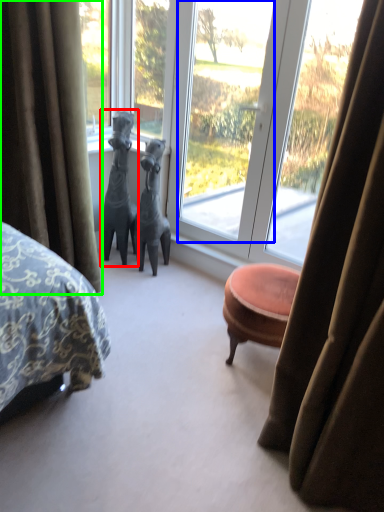
Question: Considering the real-world distances, which object is farthest from animal (highlighted by a red box)? window screen (highlighted by a blue box) or curtain (highlighted by a green box)?

Choices:
 (A) window screen
 (B) curtain

Answer: (B)